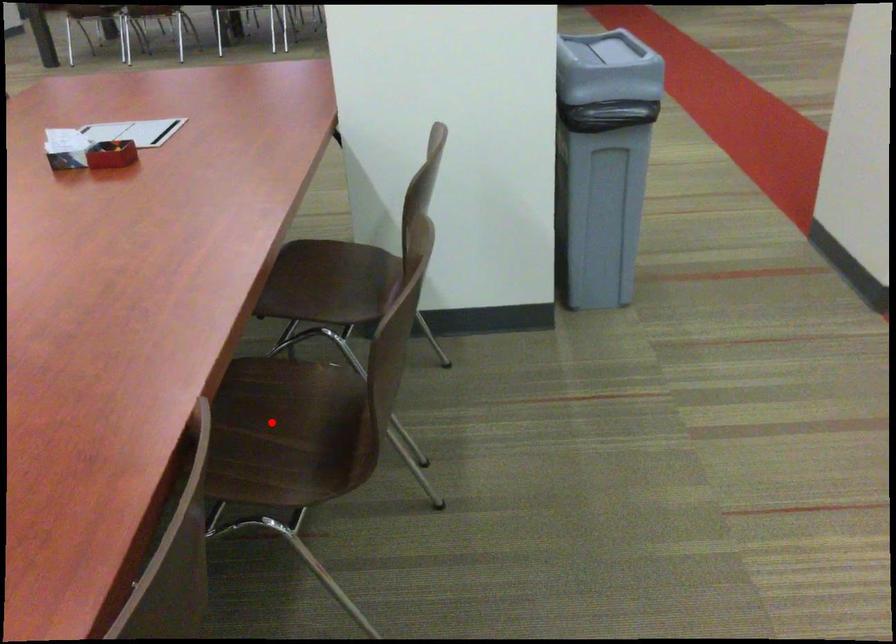
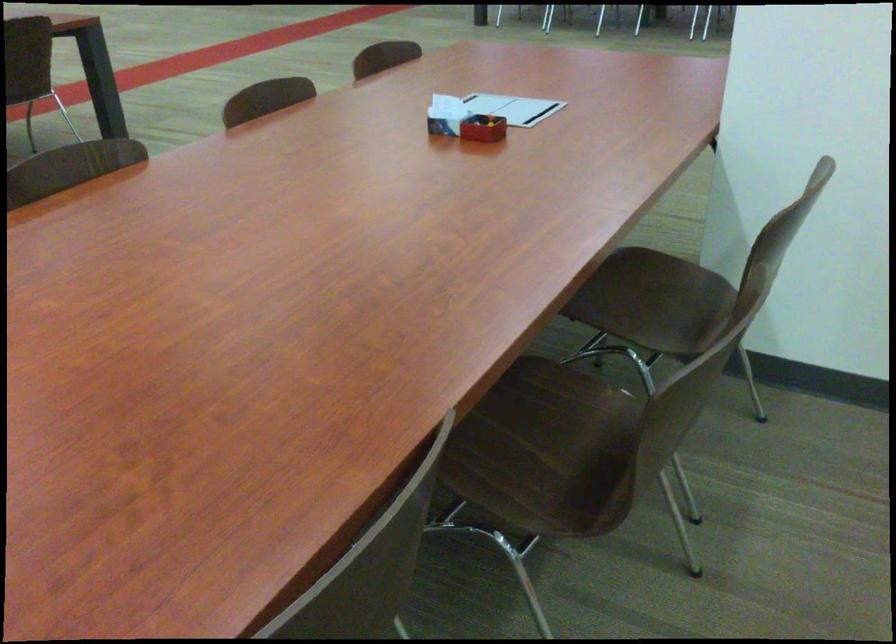
In the second image, find the point that corresponds to the highlighted location in the first image.

(541, 428)